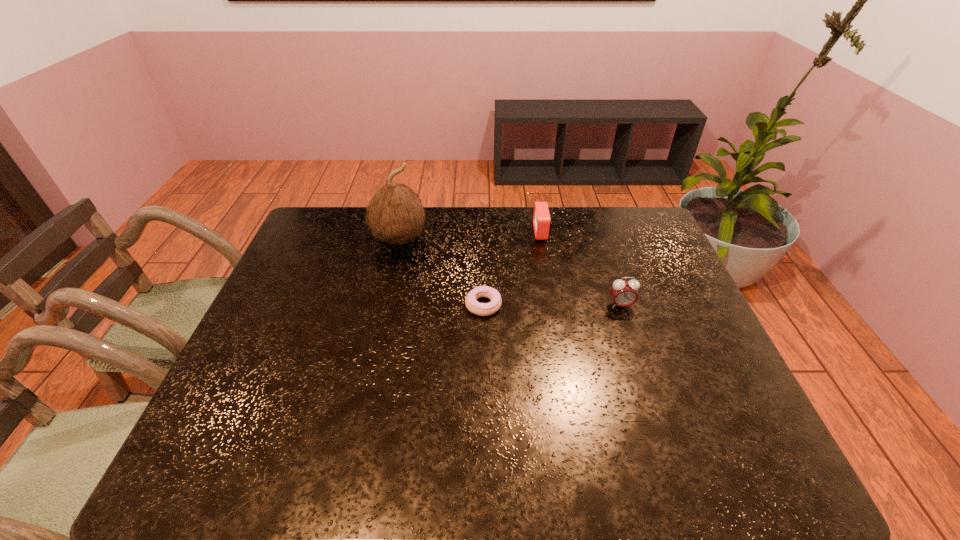
Identify the location of vacant space at the far left corner of the desktop. The image size is (960, 540). pyautogui.click(x=319, y=236).

Image resolution: width=960 pixels, height=540 pixels. In order to click on vacant space at the far right corner in this screenshot , I will do [x=627, y=237].

In the image, there is a desktop. At what (x,y) coordinates should I click in order to perform the action: click on vacant space at the near right corner. Please return your answer as a coordinate pair (x, y). The image size is (960, 540). Looking at the image, I should click on (708, 470).

Locate an element on the screen. The height and width of the screenshot is (540, 960). free area in between the nearer alarm clock and the coconut is located at coordinates (510, 272).

Find the location of a particular element. free point between the second object from right to left and the third object from right to left is located at coordinates click(x=513, y=268).

At what (x,y) coordinates should I click in order to perform the action: click on vacant space that is in between the nearer alarm clock and the doughnut. Please return your answer as a coordinate pair (x, y). Looking at the image, I should click on (552, 305).

Locate an element on the screen. The image size is (960, 540). free spot between the shortest object and the shorter alarm clock is located at coordinates (513, 268).

This screenshot has height=540, width=960. Find the location of `vacant space in between the farther alarm clock and the tallest object`. vacant space in between the farther alarm clock and the tallest object is located at coordinates (470, 235).

You are a GUI agent. You are given a task and a screenshot of the screen. Output one action in this format:
    pyautogui.click(x=<x>, y=<y>)
    Task: Click on the free point between the shortest object and the third tallest object
    The width and height of the screenshot is (960, 540).
    Given the screenshot: What is the action you would take?
    pyautogui.click(x=513, y=268)

At what (x,y) coordinates should I click in order to perform the action: click on vacant area between the third object from right to left and the rightmost object. Please return your answer as a coordinate pair (x, y). Looking at the image, I should click on (552, 305).